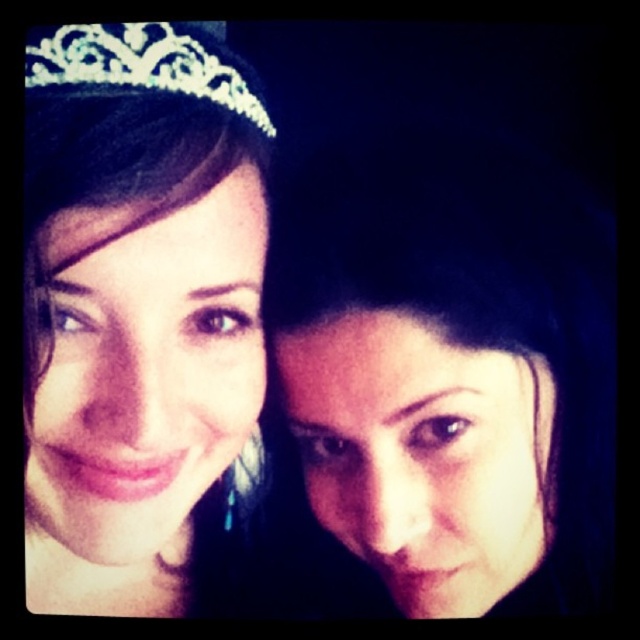
You are a photographer adjusting the camera settings. You notice the smooth skin face at right and the matte silver tiara at upper left in your frame. Which object should you adjust the focus on if you want to ensure the smaller one is sharp?

The smooth skin face at right is smaller than the matte silver tiara at upper left, so you should adjust the focus on the smooth skin face at right to ensure it is sharp.

You are taking a photo of two people in a dark room. You notice two points of light in the image, one at point (x=595, y=400) and the other at point (x=170, y=72). Which point is closer to the camera?

Point (x=595, y=400) is closer to the camera than point (x=170, y=72) because it is further to the camera.

You are a photographer trying to capture a closeup shot of both tiaras. Since the matte silver tiara at upper left and the clear crystal tiara at upper left are both in the frame, which one might appear larger in the photo due to their actual size?

The matte silver tiara at upper left is much taller than the clear crystal tiara at upper left, so it will appear larger in the photo.